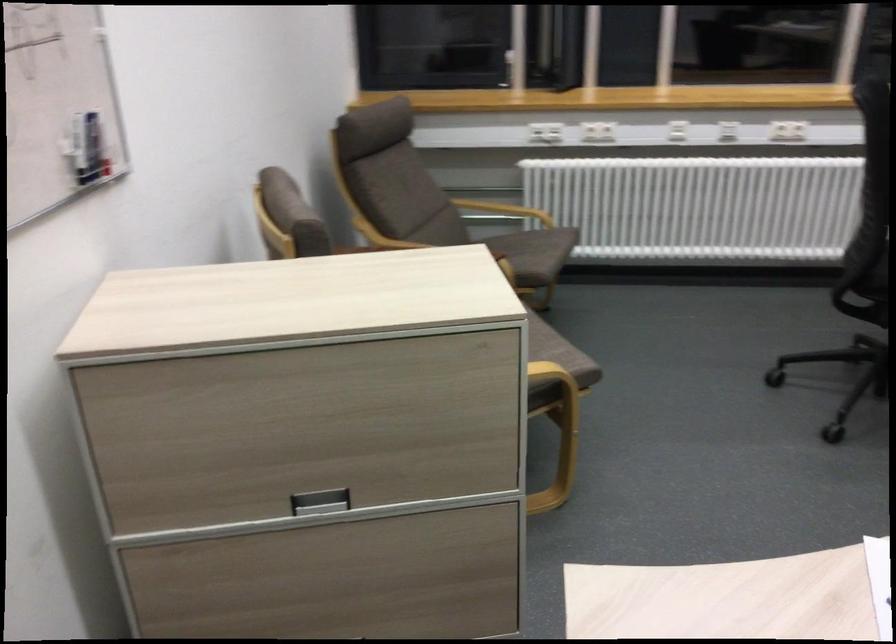
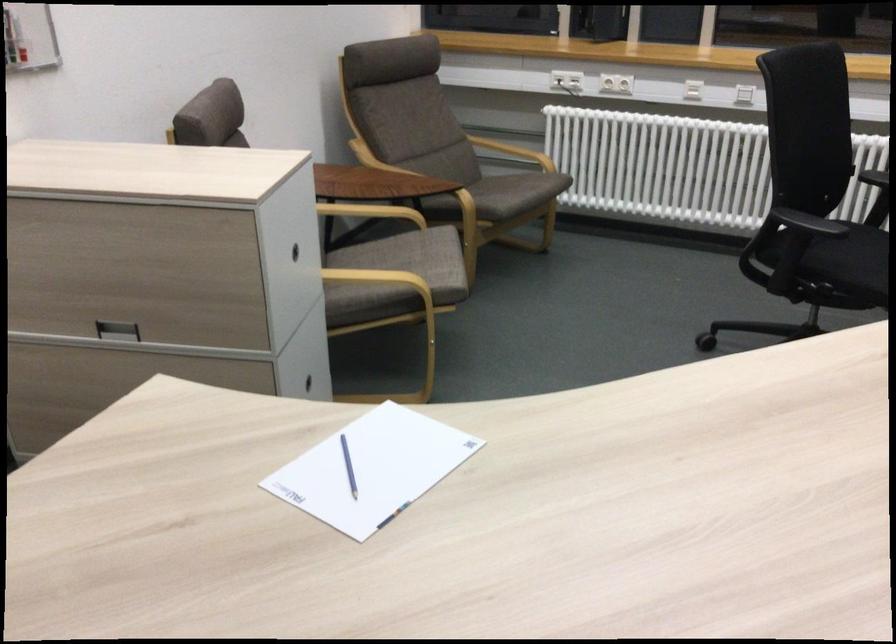
Locate, in the second image, the point that corresponds to [533,249] in the first image.

(510, 191)